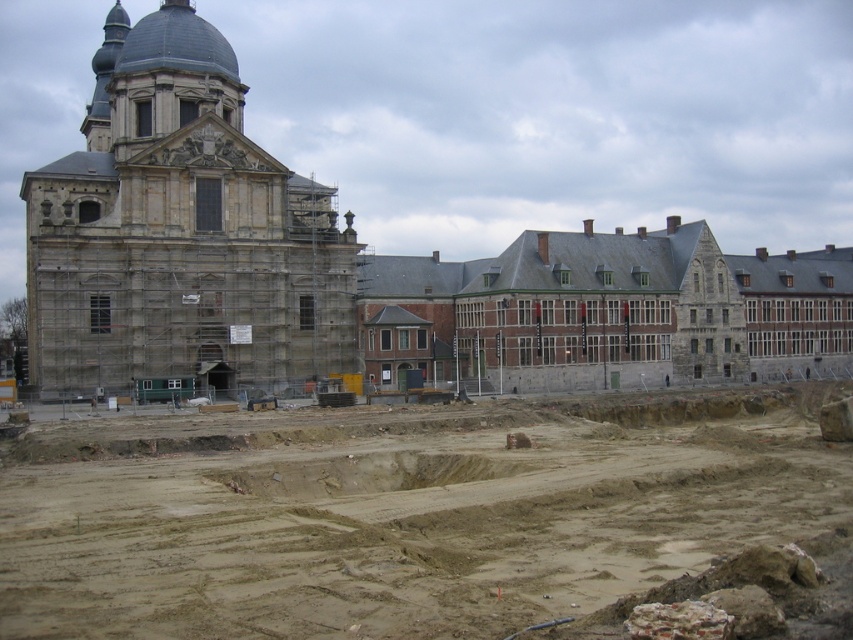
Which is in front, point (308, 516) or point (62, 352)?

Point (308, 516) is more forward.

What do you see at coordinates (416, 516) in the screenshot? This screenshot has height=640, width=853. I see `brown sandy dirt field at lower center` at bounding box center [416, 516].

Which is in front, point (399, 589) or point (53, 362)?

Positioned in front is point (399, 589).

Where is `brown sandy dirt field at lower center`? brown sandy dirt field at lower center is located at coordinates (416, 516).